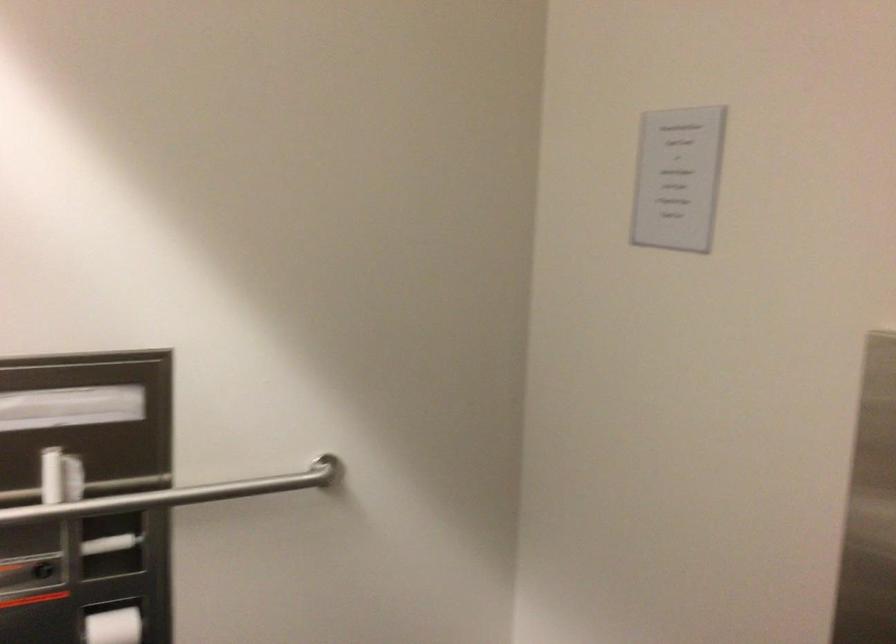
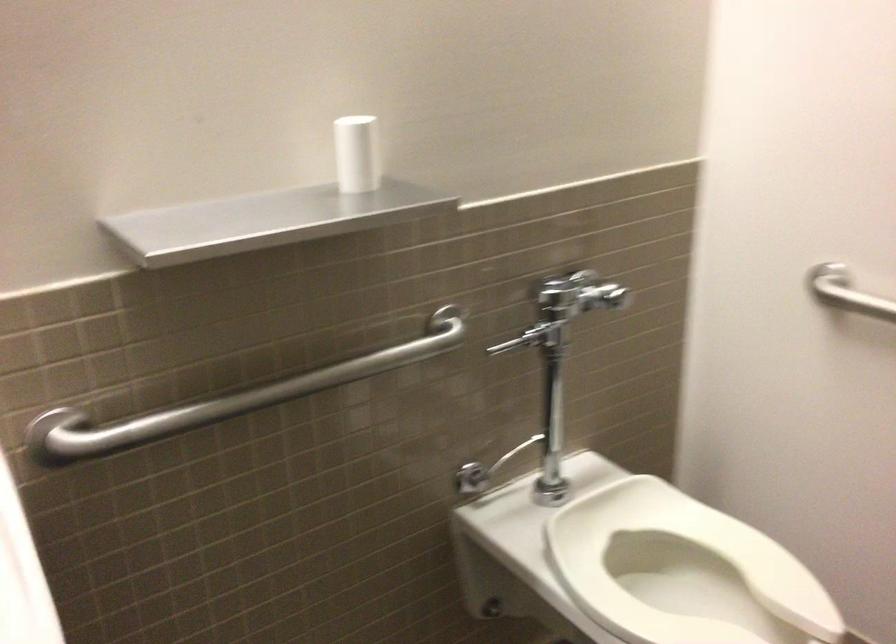
The images are taken continuously from a first-person perspective. In which direction is your viewpoint rotating?

The camera rotated toward left-down.